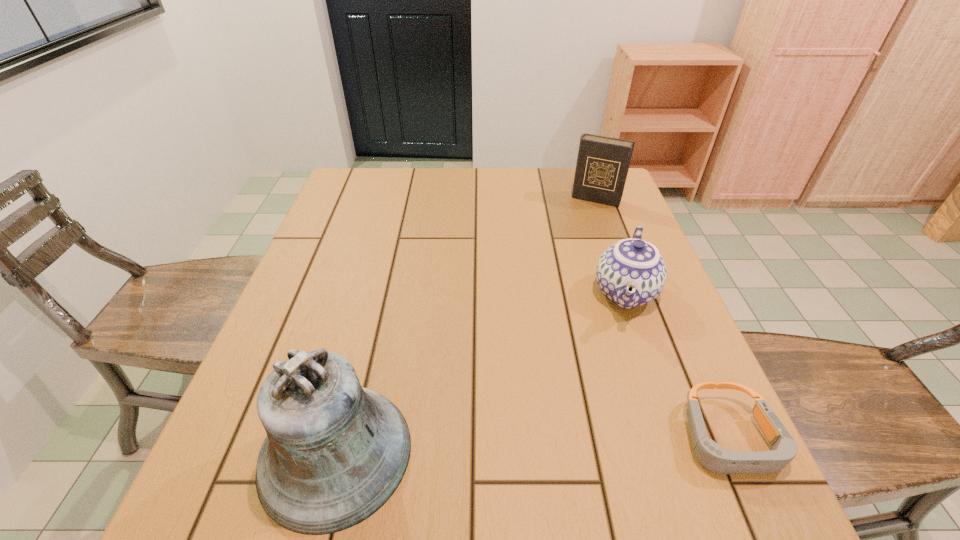
The image size is (960, 540). In order to click on diary that is at the right edge in this screenshot , I will do `click(602, 166)`.

Where is `object that is at the near left corner`? The width and height of the screenshot is (960, 540). object that is at the near left corner is located at coordinates point(335,452).

This screenshot has width=960, height=540. Find the location of `object that is at the far right corner`. object that is at the far right corner is located at coordinates 602,166.

You are a GUI agent. You are given a task and a screenshot of the screen. Output one action in this format:
    pyautogui.click(x=<x>, y=<y>)
    Task: Click on the object located at the near right corner
    
    Given the screenshot: What is the action you would take?
    (712, 456)

I want to click on blank space at the far edge of the desktop, so click(x=513, y=176).

Identify the location of vacant space at the near edge of the desktop. This screenshot has height=540, width=960. (441, 417).

Identify the location of vacant space at the left edge of the desktop. The height and width of the screenshot is (540, 960). (x=343, y=249).

Identify the location of free point at the right edge. (629, 387).

This screenshot has height=540, width=960. I want to click on vacant space at the far left corner of the desktop, so click(x=346, y=194).

Image resolution: width=960 pixels, height=540 pixels. In order to click on vacant space at the near left corner in this screenshot , I will do `click(262, 443)`.